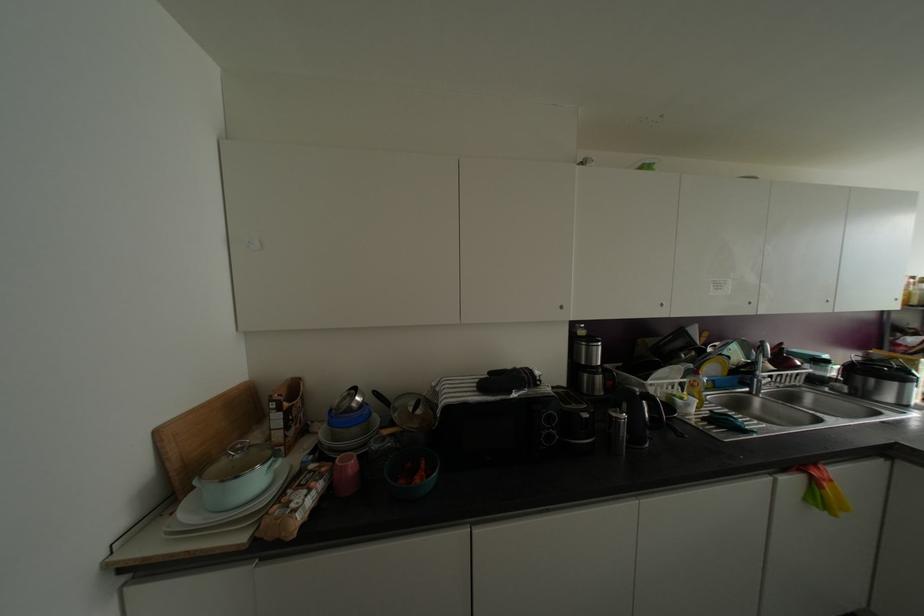
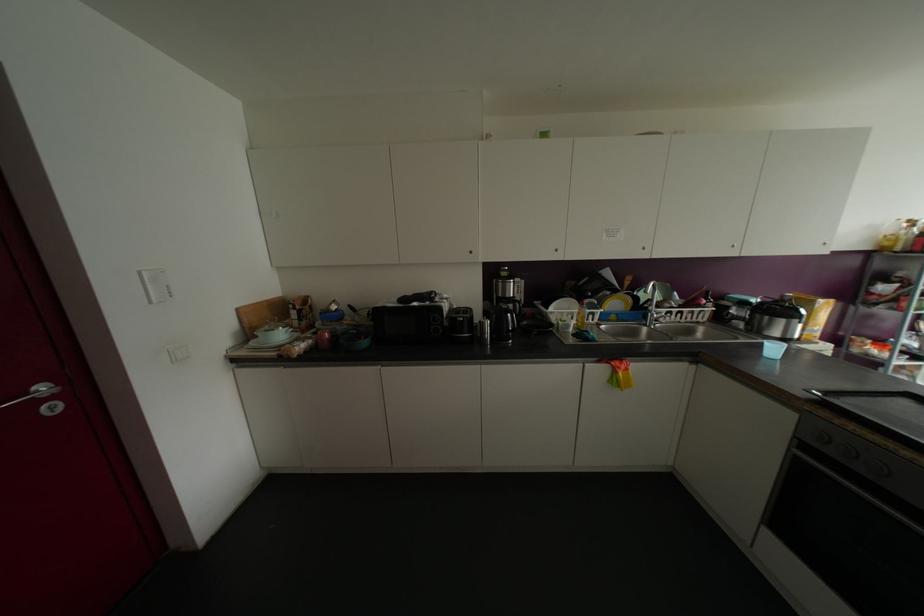
In the scene shown: The images are taken continuously from a first-person perspective. In which direction are you moving?

The movement direction of the cameraman is right, backward.